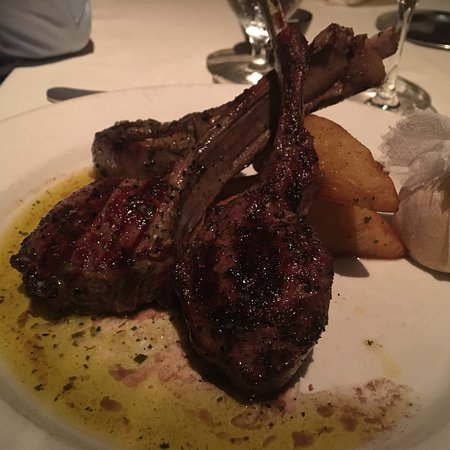
Locate an element on the screen. plate white is located at coordinates (366, 334), (405, 321), (35, 143), (173, 98), (361, 120).